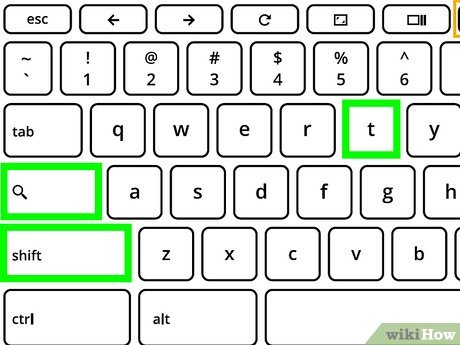
Image resolution: width=460 pixels, height=345 pixels. I want to click on numeric keys on keyboard, so click(x=91, y=70), click(x=159, y=69), click(x=217, y=68), click(x=280, y=66), click(x=341, y=68), click(x=410, y=74).